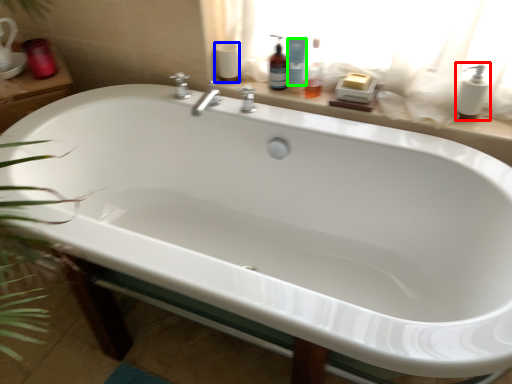
Question: Considering the real-world distances, which object is closest to soap dispenser (highlighted by a red box)? toilet paper (highlighted by a blue box) or cleaning product (highlighted by a green box).

Choices:
 (A) toilet paper
 (B) cleaning product

Answer: (B)